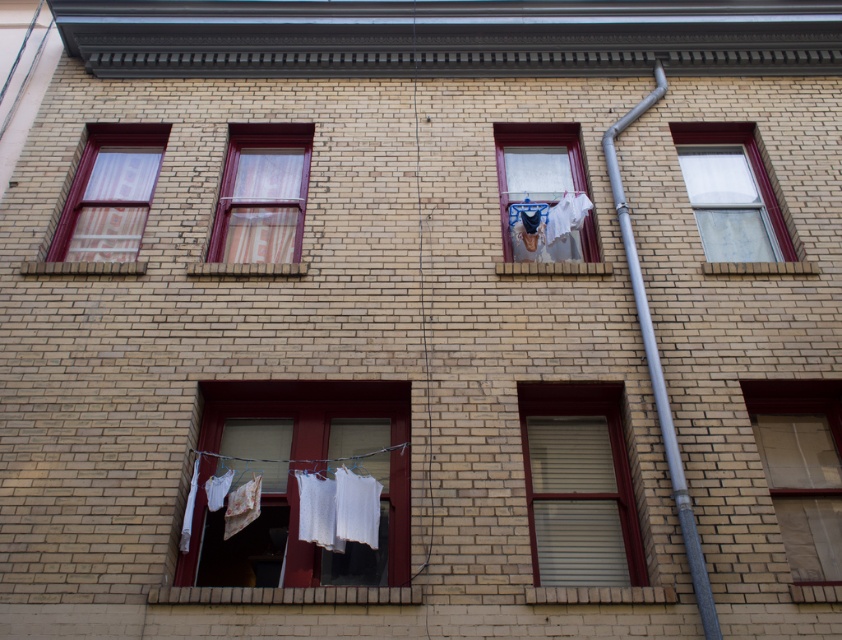
Question: Which point is closer to the camera?

Choices:
 (A) (x=707, y=252)
 (B) (x=534, y=518)

Answer: (B)

Question: Which point is farther to the camera?

Choices:
 (A) matte glass window at center
 (B) matte glass window at lower right

Answer: (B)

Question: Can you confirm if matte glass window at lower right is positioned to the right of white sheer curtain at center?

Choices:
 (A) no
 (B) yes

Answer: (B)

Question: Does white fabric at lower center appear under striped fabric window at center?

Choices:
 (A) yes
 (B) no

Answer: (A)

Question: Which is nearer to the matte glass window at upper right?

Choices:
 (A) white sheer curtain at center
 (B) matte glass window at upper left
 (C) matte glass window at lower right

Answer: (A)

Question: Is white sheer curtain at center positioned in front of striped fabric window at center?

Choices:
 (A) yes
 (B) no

Answer: (B)